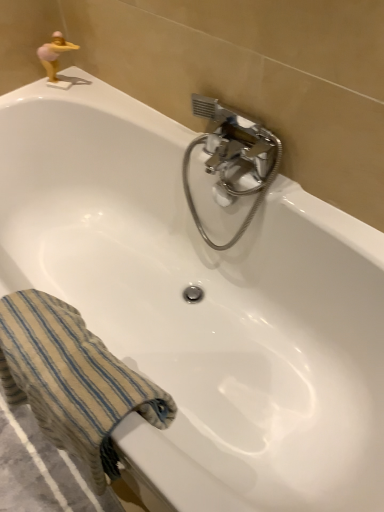
At what (x,y) coordinates should I click in order to perform the action: click on vacant space in front of gold plastic figurine at upper left. Please return your answer as a coordinate pair (x, y). The width and height of the screenshot is (384, 512). Looking at the image, I should click on (76, 98).